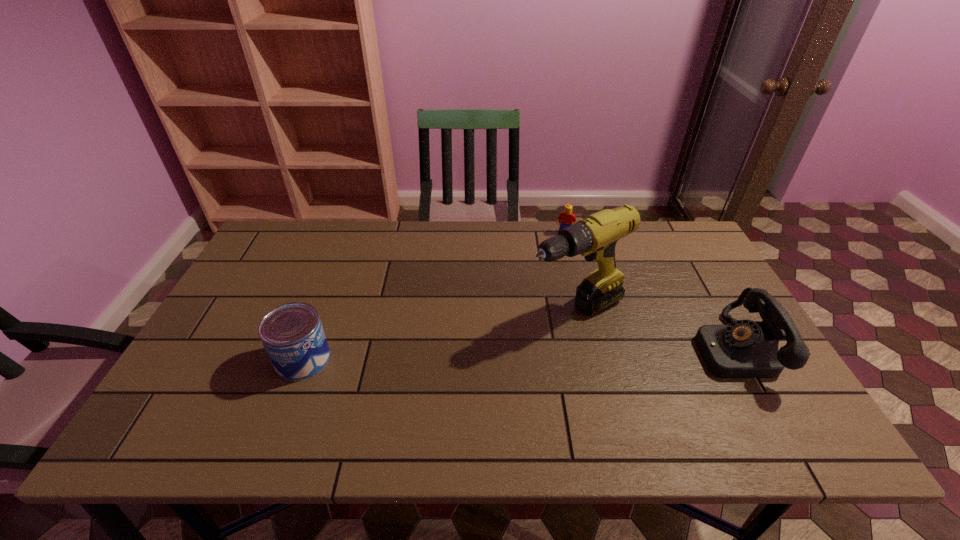
Identify the location of the leftmost object. (292, 334).

The image size is (960, 540). What are the coordinates of `the second shortest object` in the screenshot? It's located at (292, 334).

At what (x,y) coordinates should I click in order to perform the action: click on telephone. Please return your answer as a coordinate pair (x, y). This screenshot has height=540, width=960. Looking at the image, I should click on (744, 349).

Image resolution: width=960 pixels, height=540 pixels. What are the coordinates of `drill` in the screenshot? It's located at (595, 237).

Identify the location of the farthest object. (565, 219).

At what (x,y) coordinates should I click in order to perform the action: click on the shortest object. Please return your answer as a coordinate pair (x, y). The height and width of the screenshot is (540, 960). Looking at the image, I should click on (565, 219).

Where is `free region located on the front label of the can`? free region located on the front label of the can is located at coordinates (350, 359).

The height and width of the screenshot is (540, 960). What are the coordinates of `vacant space located on the dial of the rightmost object` in the screenshot? It's located at (647, 349).

Locate an element on the screen. This screenshot has height=540, width=960. vacant region located 0.400m on the dial of the rightmost object is located at coordinates (541, 349).

Find the location of `vacant space located on the dial of the rightmost object`. vacant space located on the dial of the rightmost object is located at coordinates (651, 349).